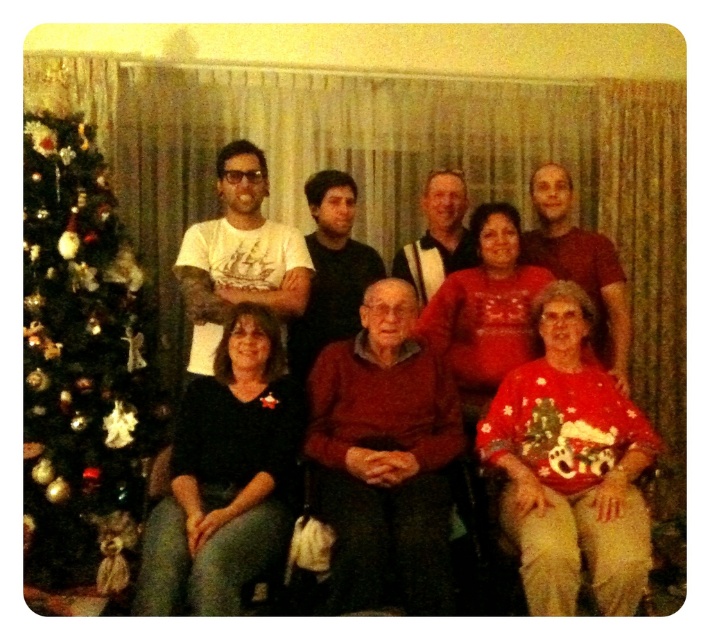
Which of these two, green shiny christmas tree at left or red sweater at center, stands shorter?

Standing shorter between the two is red sweater at center.

Which is in front, point (97, 346) or point (204, 356)?

Point (204, 356)

Does point (60, 333) come closer to viewer compared to point (338, 252)?

Yes, it is in front of point (338, 252).

Image resolution: width=710 pixels, height=640 pixels. What are the coordinates of `green shiny christmas tree at left` in the screenshot? It's located at (80, 365).